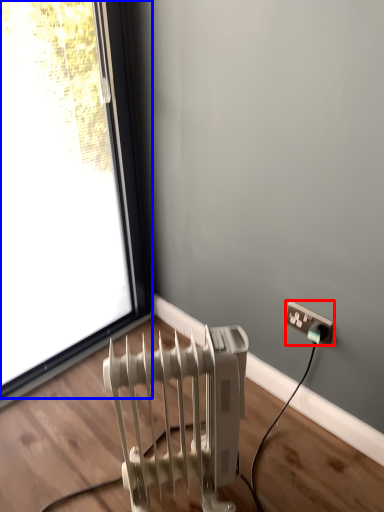
Question: Among these objects, which one is farthest to the camera, power plugs and sockets (highlighted by a red box) or window (highlighted by a blue box)?

Choices:
 (A) power plugs and sockets
 (B) window

Answer: (A)